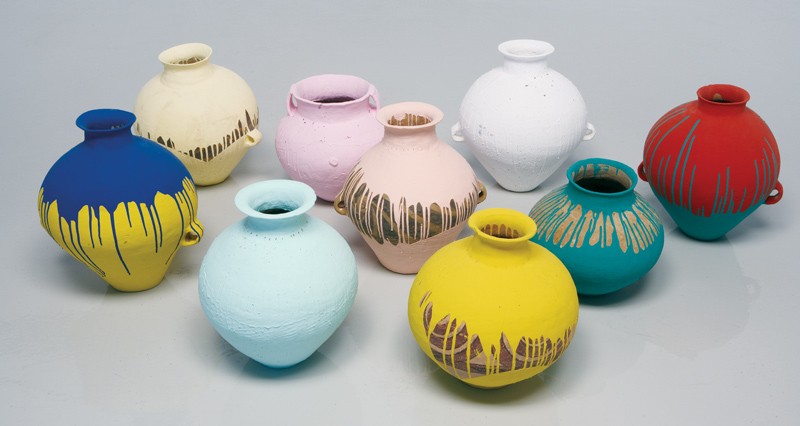
Image resolution: width=800 pixels, height=426 pixels. I want to click on vase, so click(x=729, y=206).